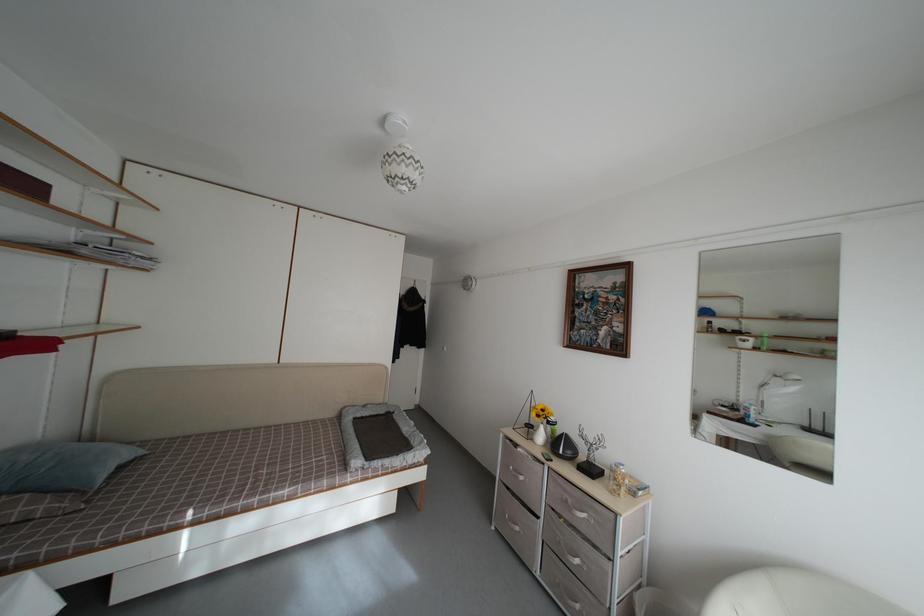
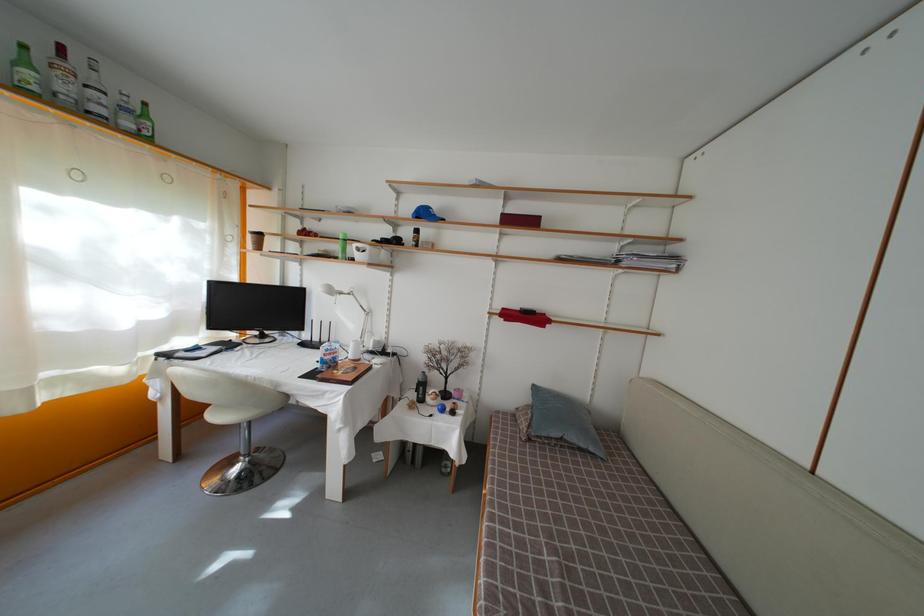
Locate, in the second image, the point that corresponds to pixel 103 499 in the first image.

(550, 450)